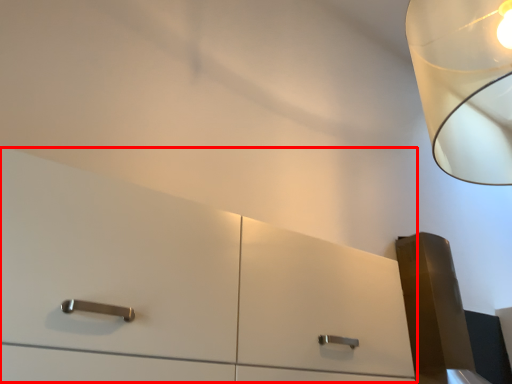
Question: From the image, what is the correct spatial relationship of dresser (annotated by the red box) in relation to lamp?

Choices:
 (A) right
 (B) left

Answer: (B)